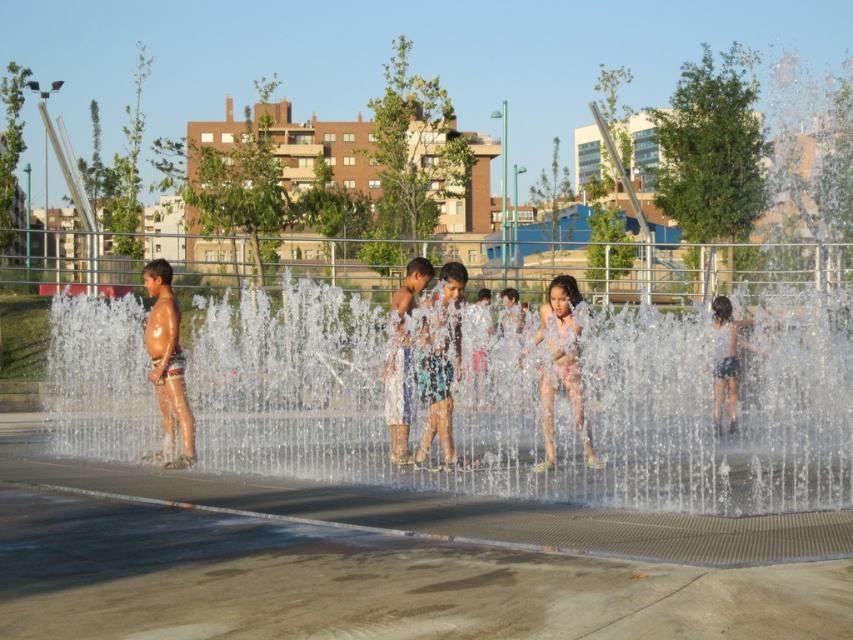
Between blue denim shorts at center and dark blue shorts at right, which one is positioned lower?

dark blue shorts at right is below.

This screenshot has height=640, width=853. Identify the location of blue denim shorts at center. (440, 360).

Between point (457, 353) and point (717, 362), which one is positioned in front?

Point (457, 353) is more forward.

Find the location of `blue denim shorts at center`. blue denim shorts at center is located at coordinates (440, 360).

Describe the element at coordinates (167, 365) in the screenshot. Image resolution: width=853 pixels, height=640 pixels. I see `shiny metallic shorts at left` at that location.

Can you confirm if shiny metallic shorts at left is positioned above white cotton shorts at center?

Yes.

Who is more distant from viewer, (186,422) or (393,356)?

The point (186,422) is behind.

The image size is (853, 640). I want to click on shiny metallic shorts at left, so click(167, 365).

Who is shorter, clear water at center or blue denim shorts at center?

clear water at center

Is the position of clear water at center less distant than that of blue denim shorts at center?

Yes, clear water at center is closer to the viewer.

You are a GUI agent. You are given a task and a screenshot of the screen. Output one action in this format:
    pyautogui.click(x=<x>, y=<y>)
    Task: Click on the clear water at center
    The height and width of the screenshot is (640, 853).
    Given the screenshot: What is the action you would take?
    pyautogui.click(x=527, y=406)

This screenshot has width=853, height=640. In order to click on clear water at center in this screenshot , I will do `click(527, 406)`.